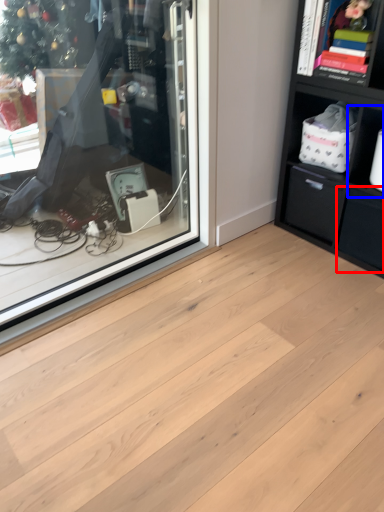
Question: Which point is further to the camera, drawer (highlighted by a red box) or cabinet (highlighted by a blue box)?

Choices:
 (A) drawer
 (B) cabinet

Answer: (A)